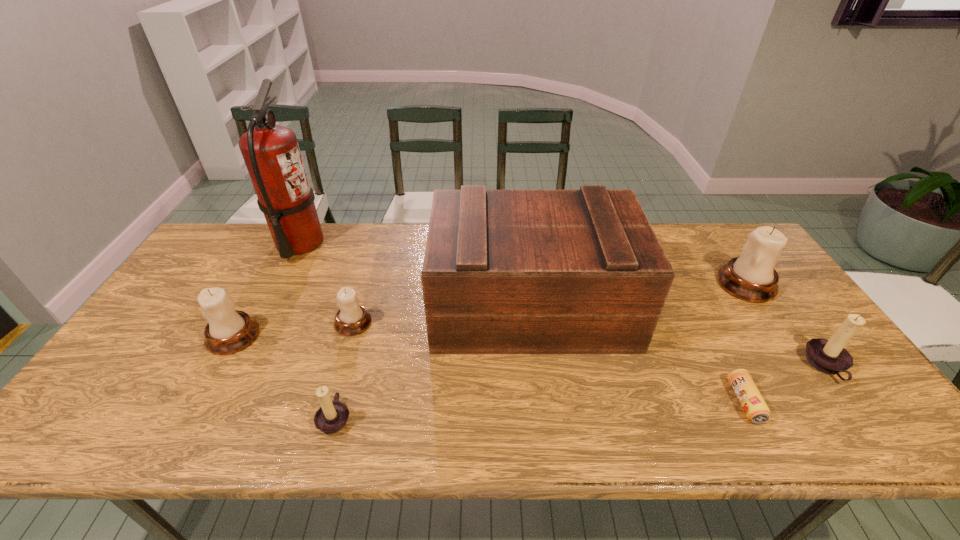
Where is `the smallest white candle holder`? The height and width of the screenshot is (540, 960). the smallest white candle holder is located at coordinates (352, 319).

Find the location of `the nearer brown candle holder`. the nearer brown candle holder is located at coordinates (331, 417).

Where is `the left brown candle holder`? The width and height of the screenshot is (960, 540). the left brown candle holder is located at coordinates (331, 417).

The image size is (960, 540). Find the location of `the shortest object`. the shortest object is located at coordinates (752, 402).

I want to click on beer can, so click(x=752, y=402).

This screenshot has height=540, width=960. Find the location of `vacant space located toward the nozzle of the tallest object`. vacant space located toward the nozzle of the tallest object is located at coordinates (396, 243).

Locate an element on the screen. This screenshot has height=540, width=960. vacant area located 0.090m on the back of the fifth object from left to right is located at coordinates (525, 249).

What are the coordinates of `blank area located 0.390m on the left of the rightmost white candle holder` in the screenshot? It's located at (588, 284).

Identify the location of free space located on the back of the leftmost candle holder. (x=258, y=291).

Where is `free location located on the wick of the farther brown candle holder`? free location located on the wick of the farther brown candle holder is located at coordinates (719, 366).